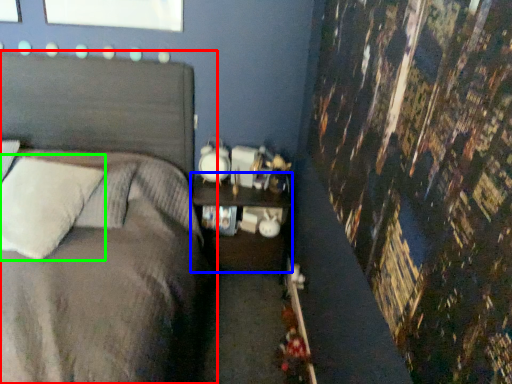
Question: Which object is positioned closest to bed (highlighted by a red box)? Select from nightstand (highlighted by a blue box) and pillow (highlighted by a green box).

Choices:
 (A) nightstand
 (B) pillow

Answer: (B)